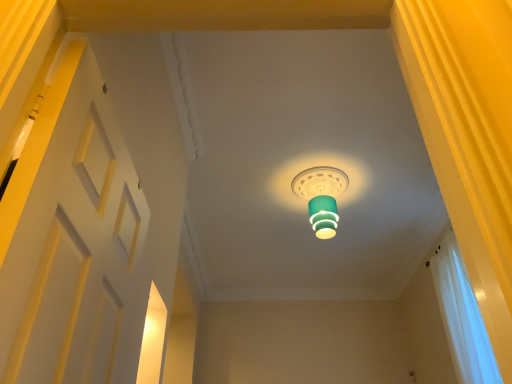
Question: Can you confirm if white matte door at left is positioned to the right of teal glossy lampshade at center?

Choices:
 (A) yes
 (B) no

Answer: (B)

Question: Is white matte door at left facing away from teal glossy lampshade at center?

Choices:
 (A) yes
 (B) no

Answer: (B)

Question: Is white matte door at left positioned beyond the bounds of teal glossy lampshade at center?

Choices:
 (A) no
 (B) yes

Answer: (B)

Question: Could you tell me if white matte door at left is turned towards teal glossy lampshade at center?

Choices:
 (A) yes
 (B) no

Answer: (B)

Question: Can you see white matte door at left touching teal glossy lampshade at center?

Choices:
 (A) yes
 (B) no

Answer: (B)

Question: From the image's perspective, is white matte door at left located beneath teal glossy lampshade at center?

Choices:
 (A) yes
 (B) no

Answer: (A)

Question: Can white sheer curtain at right be found inside teal glossy lampshade at center?

Choices:
 (A) no
 (B) yes

Answer: (A)

Question: Can you confirm if teal glossy lampshade at center is taller than white sheer curtain at right?

Choices:
 (A) no
 (B) yes

Answer: (A)

Question: Considering the relative positions of teal glossy lampshade at center and white sheer curtain at right in the image provided, is teal glossy lampshade at center to the right of white sheer curtain at right from the viewer's perspective?

Choices:
 (A) yes
 (B) no

Answer: (B)

Question: Is teal glossy lampshade at center to the left of white sheer curtain at right from the viewer's perspective?

Choices:
 (A) no
 (B) yes

Answer: (B)

Question: Is teal glossy lampshade at center bigger than white sheer curtain at right?

Choices:
 (A) yes
 (B) no

Answer: (B)

Question: Is teal glossy lampshade at center completely or partially outside of white sheer curtain at right?

Choices:
 (A) yes
 (B) no

Answer: (A)

Question: From the image's perspective, would you say white matte door at left is shown under white sheer curtain at right?

Choices:
 (A) yes
 (B) no

Answer: (B)